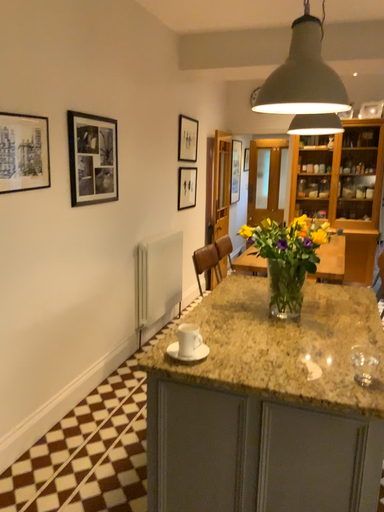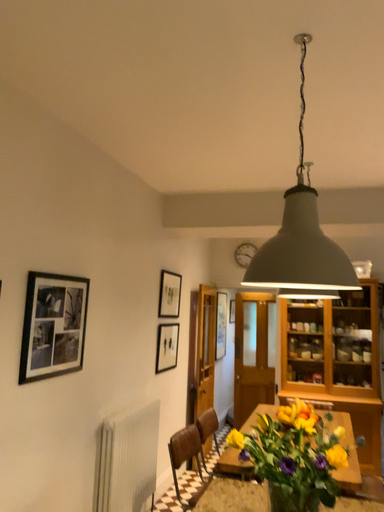
Question: How did the camera likely rotate when shooting the video?

Choices:
 (A) rotated downward
 (B) rotated upward

Answer: (B)